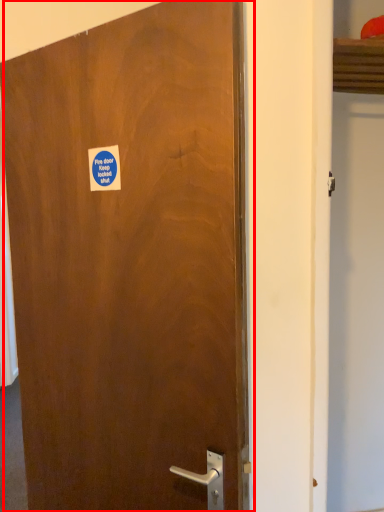
Question: From the image's perspective, considering the relative positions of door (annotated by the red box) and sticker in the image provided, where is door (annotated by the red box) located with respect to the staircase?

Choices:
 (A) above
 (B) below

Answer: (B)